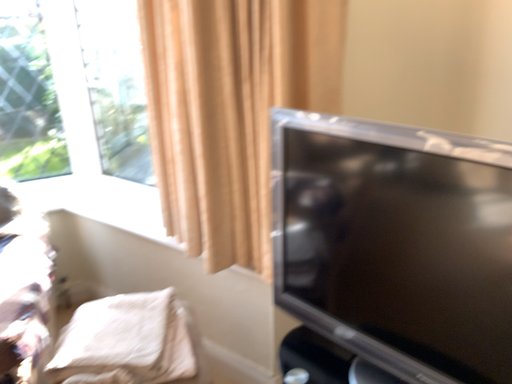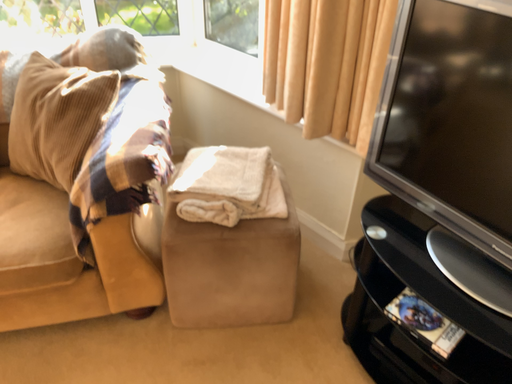
Question: How did the camera likely rotate when shooting the video?

Choices:
 (A) rotated right
 (B) rotated left

Answer: (B)